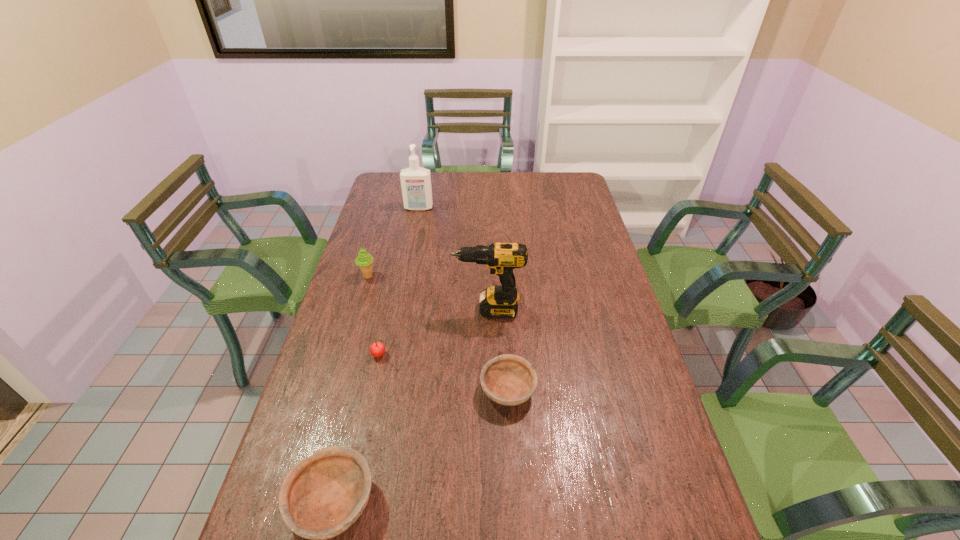
In the current image, all bowls are evenly spaced. To maintain this equal spacing, where should an additional bowl be placed on the right? Please point out a free spot. Please provide its 2D coordinates. Your answer should be formatted as a tuple, i.e. [(x, y)], where the tuple contains the x and y coordinates of a point satisfying the conditions above.

[(629, 313)]